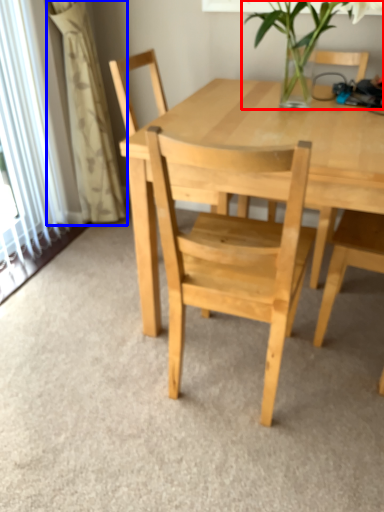
Question: Which point is further to the camera, houseplant (highlighted by a red box) or curtain (highlighted by a blue box)?

Choices:
 (A) houseplant
 (B) curtain

Answer: (B)